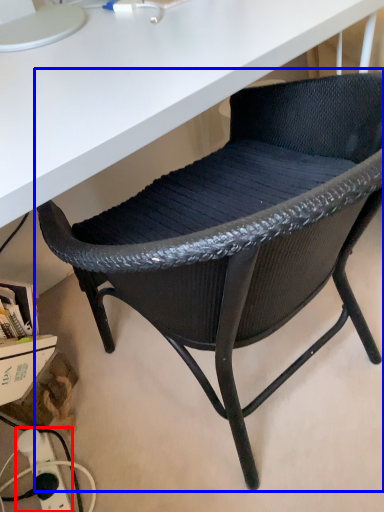
Question: Which of the following is the farthest to the observer, electric outlet (highlighted by a red box) or chair (highlighted by a blue box)?

Choices:
 (A) electric outlet
 (B) chair

Answer: (A)